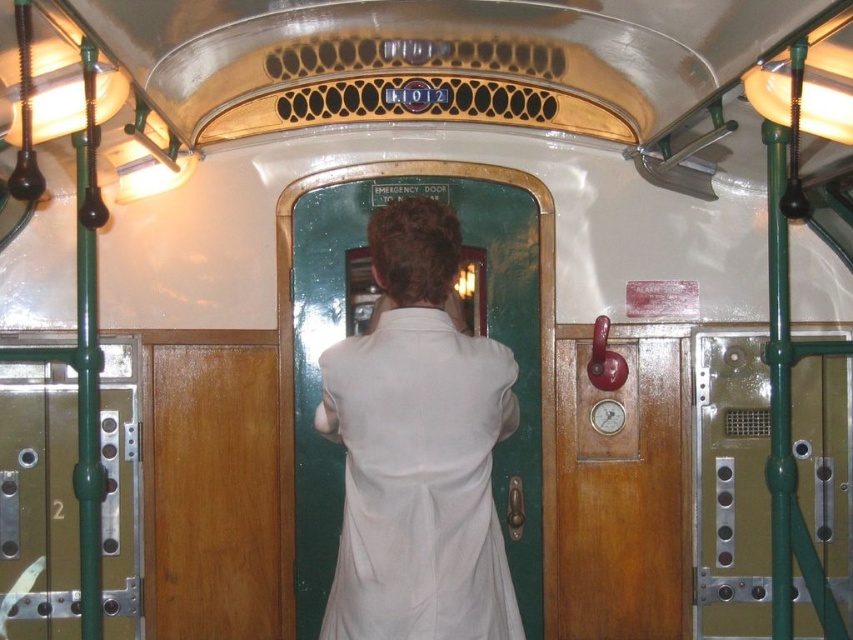
Which of these two, white matte dress at center or brown wooden door at right, stands taller?

Standing taller between the two is brown wooden door at right.

Does white matte dress at center come in front of brown wooden door at right?

Yes.

Image resolution: width=853 pixels, height=640 pixels. I want to click on white matte dress at center, so click(419, 481).